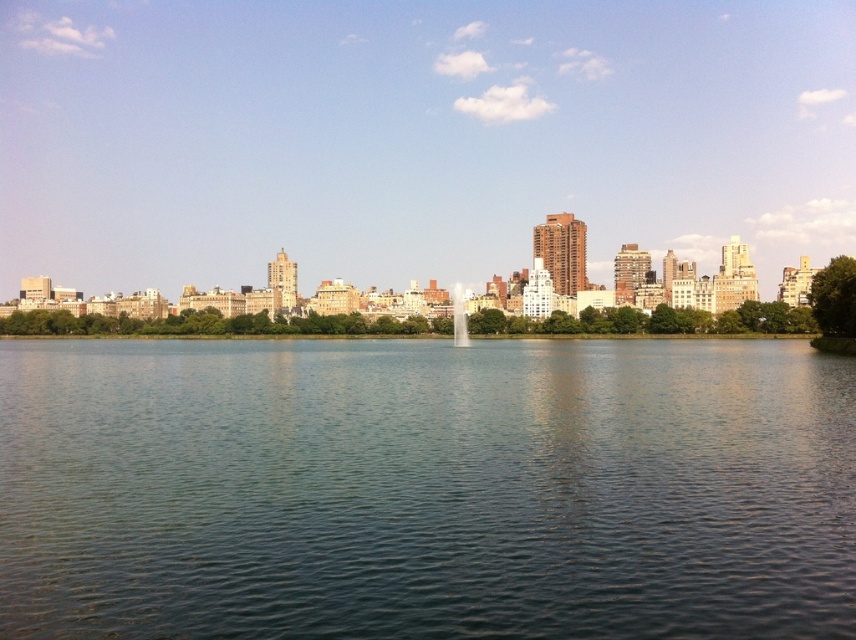
You are standing at the edge of the clear water at center and want to walk to the transparent glass fountain at center. Which direction should you move in?

You should move to the right to reach the transparent glass fountain at center because the clear water at center is to the left of it.

You are a city planner trying to install a new bench between the clear water at center and the transparent glass fountain at center. The bench will be 2 meters long. Is there enough space to place it without moving either object?

The clear water at center and transparent glass fountain at center are 87.46 meters apart, so there is more than enough space to place a 2 meter long bench between them.

You are standing at the point marked by the coordinates point (425, 488) in the image. What is the immediate environment like around you?

The point (425, 488) marks clear water at center, so you are standing in clear water at center.